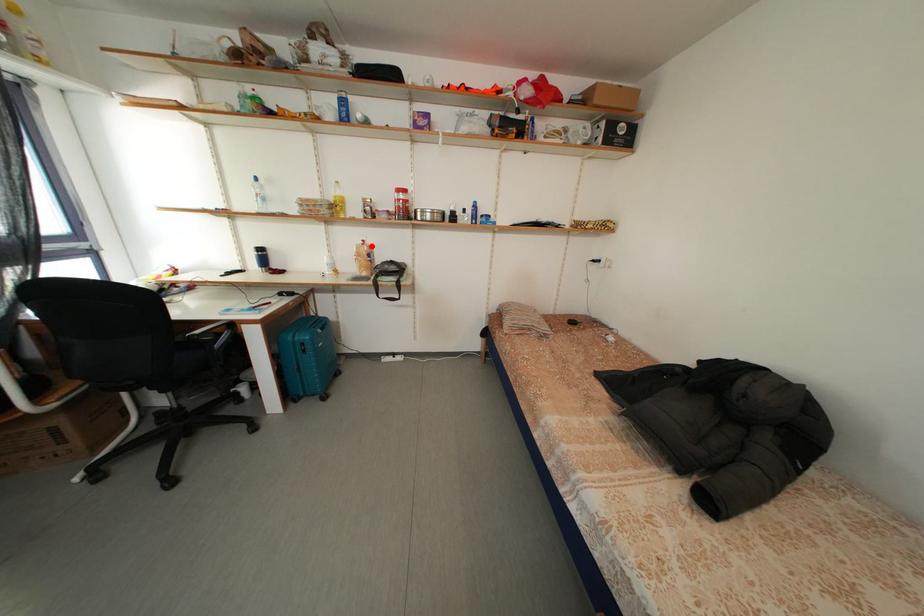
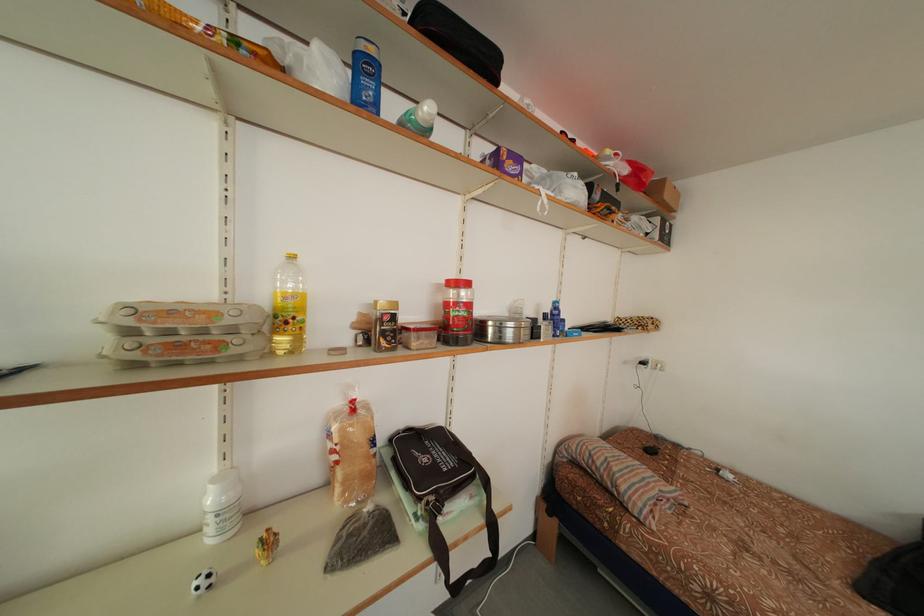
Where in the second image is the point corresponding to the highlighted location from the first image?

(360, 407)